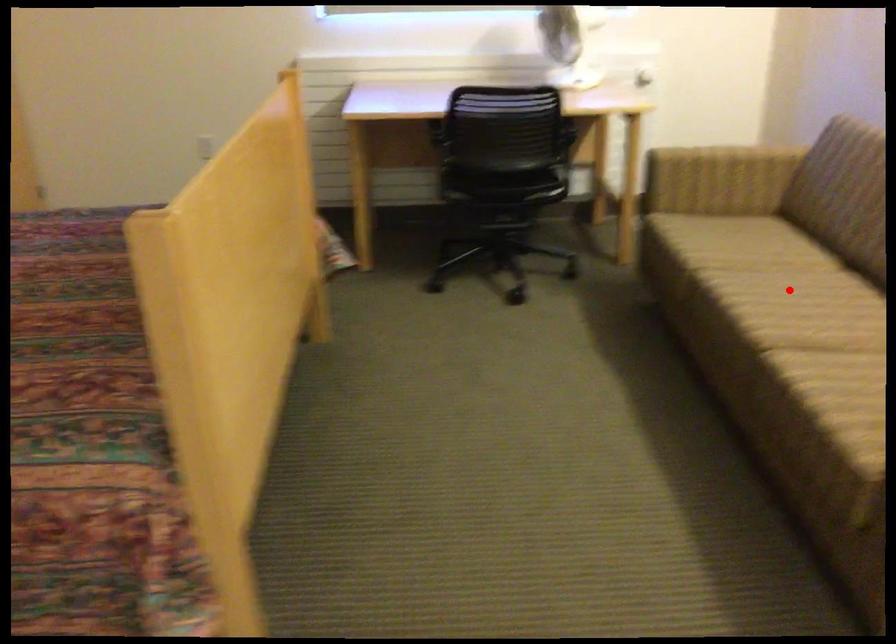
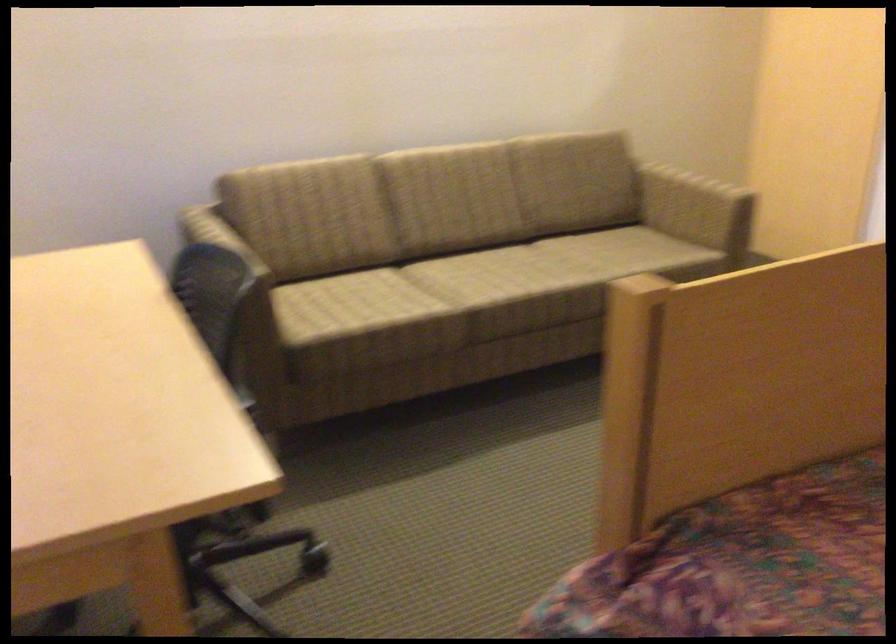
Where in the second image is the point corresponding to the highlighted location from the first image?

(470, 279)